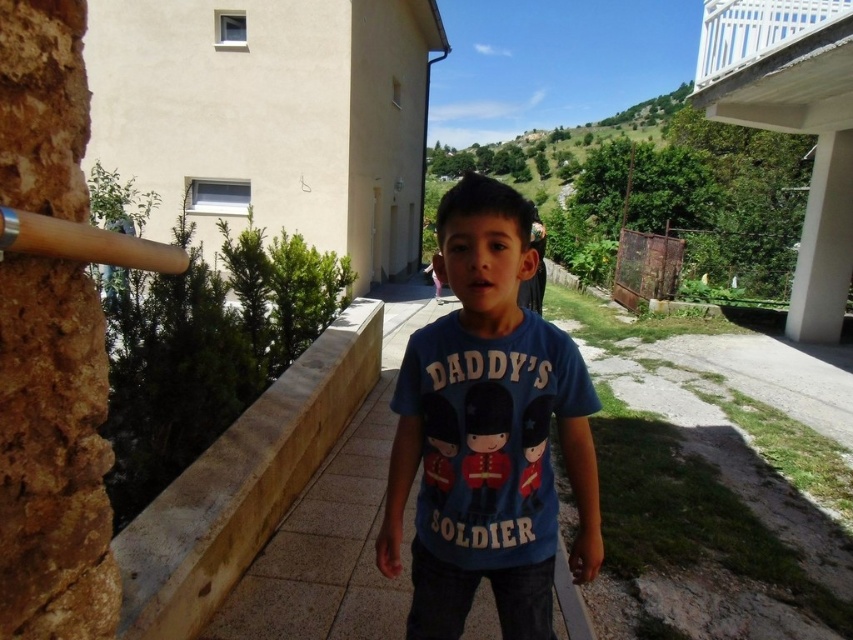
Question: Does brown concrete ledge at left have a smaller size compared to blue fabric shirt at center?

Choices:
 (A) yes
 (B) no

Answer: (B)

Question: Which object appears closest to the camera in this image?

Choices:
 (A) wooden bat at left
 (B) blue cotton shirt at center

Answer: (A)

Question: Which object appears farthest from the camera in this image?

Choices:
 (A) blue cotton shirt at center
 (B) wooden bat at left

Answer: (A)

Question: Is blue fabric shirt at center to the left of wooden bat at left from the viewer's perspective?

Choices:
 (A) no
 (B) yes

Answer: (B)

Question: Which of the following is the farthest from the observer?

Choices:
 (A) click(20, 224)
 (B) click(262, 586)
 (C) click(163, 544)

Answer: (B)

Question: Is blue cotton shirt at center below brown concrete ledge at left?

Choices:
 (A) no
 (B) yes

Answer: (A)